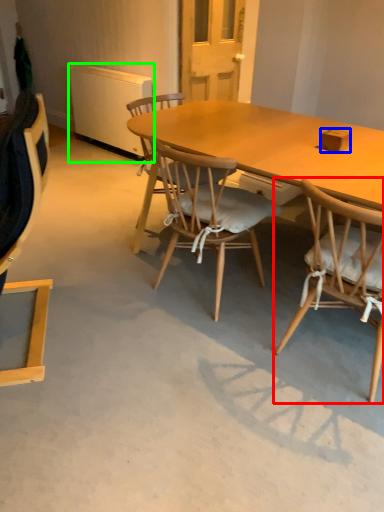
Question: Considering the real-world distances, which object is closest to chair (highlighted by a red box)? box (highlighted by a blue box) or radiator (highlighted by a green box).

Choices:
 (A) box
 (B) radiator

Answer: (A)